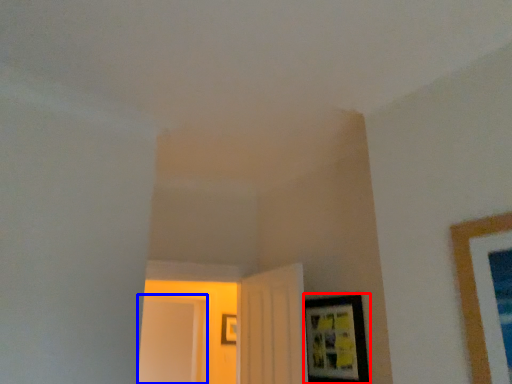
Question: Which object is further to the camera taking this photo, picture frame (highlighted by a red box) or glass door (highlighted by a blue box)?

Choices:
 (A) picture frame
 (B) glass door

Answer: (B)